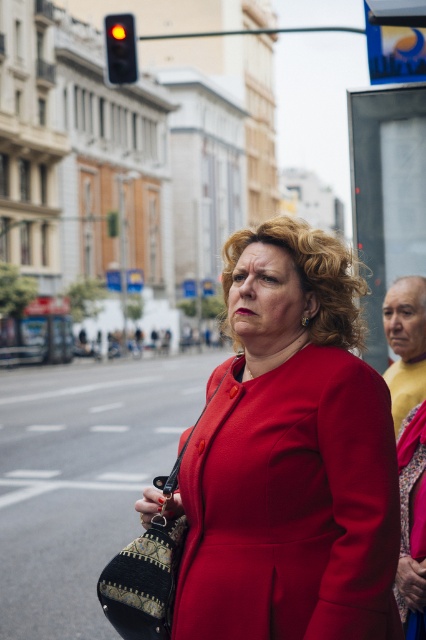
You are a pedestrian waiting to cross the street. You see the velvet red dress at center and the red glass traffic light at upper left. Which object is closer to your right side?

The velvet red dress at center is positioned on the right side of red glass traffic light at upper left, so it is closer to your right side.

You are a photographer standing at the camera position. You want to take a photo of both the point at coordinates point (402, 563) and point (123, 58). Which point will appear larger in your photo?

Point (402, 563) is closer to the camera than point (123, 58), so it will appear larger in the photo.

You are a fashion designer observing a woman wearing both a matte red coat at center and a velvet red dress at center. Which clothing item is taller?

The matte red coat at center is taller than the velvet red dress at center.